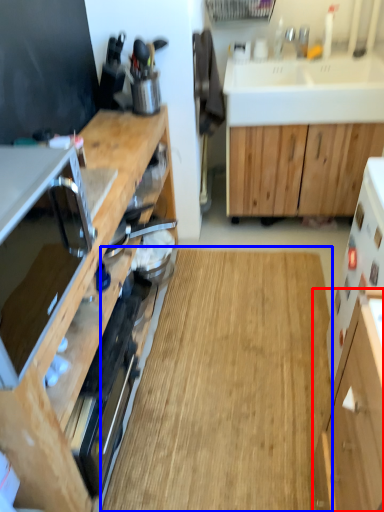
Question: Among these objects, which one is nearest to the camera, cabinetry (highlighted by a red box) or hardwood (highlighted by a blue box)?

Choices:
 (A) cabinetry
 (B) hardwood

Answer: (A)